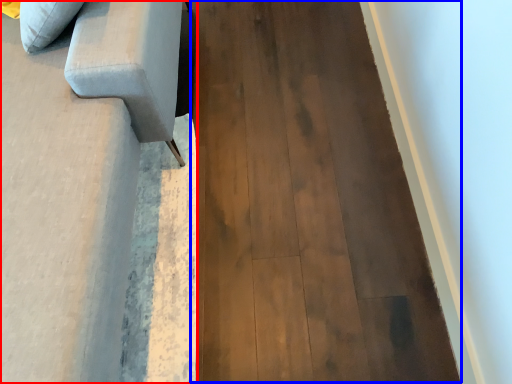
Question: Which object appears farthest to the camera in this image, furniture (highlighted by a red box) or plywood (highlighted by a blue box)?

Choices:
 (A) furniture
 (B) plywood

Answer: (B)